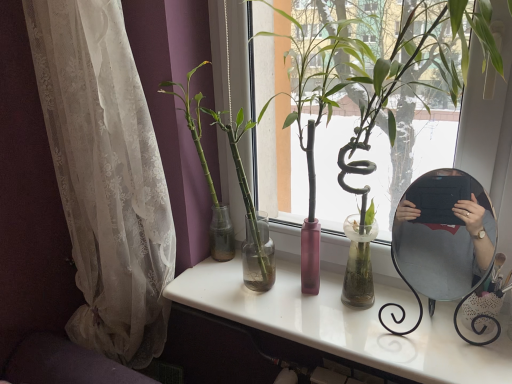
Question: Is white lace curtain at left not near metallic silver mirror at right?

Choices:
 (A) no
 (B) yes

Answer: (A)

Question: From the image's perspective, is white lace curtain at left under metallic silver mirror at right?

Choices:
 (A) yes
 (B) no

Answer: (B)

Question: From a real-world perspective, is white lace curtain at left positioned over metallic silver mirror at right based on gravity?

Choices:
 (A) no
 (B) yes

Answer: (B)

Question: Is white lace curtain at left to the right of metallic silver mirror at right from the viewer's perspective?

Choices:
 (A) yes
 (B) no

Answer: (B)

Question: Is white lace curtain at left at the left side of metallic silver mirror at right?

Choices:
 (A) yes
 (B) no

Answer: (A)

Question: Considering the relative sizes of white lace curtain at left and metallic silver mirror at right in the image provided, is white lace curtain at left taller than metallic silver mirror at right?

Choices:
 (A) yes
 (B) no

Answer: (A)

Question: Does white lace curtain at left lie behind green glossy bamboo at center, which is the second houseplant from left to right?

Choices:
 (A) yes
 (B) no

Answer: (A)

Question: Considering the relative positions of white lace curtain at left and green glossy bamboo at center, which is the second houseplant from left to right, in the image provided, is white lace curtain at left to the right of green glossy bamboo at center, which is the second houseplant from left to right, from the viewer's perspective?

Choices:
 (A) yes
 (B) no

Answer: (B)

Question: Can you confirm if white lace curtain at left is taller than green glossy bamboo at center, which is the second houseplant from left to right?

Choices:
 (A) no
 (B) yes

Answer: (B)

Question: Does white lace curtain at left have a lesser height compared to green glossy bamboo at center, arranged as the 1th houseplant when viewed from the right?

Choices:
 (A) no
 (B) yes

Answer: (A)

Question: Considering the relative sizes of white lace curtain at left and green glossy bamboo at center, which is the second houseplant from left to right, in the image provided, is white lace curtain at left thinner than green glossy bamboo at center, which is the second houseplant from left to right,?

Choices:
 (A) no
 (B) yes

Answer: (B)

Question: Considering the relative sizes of white lace curtain at left and green glossy bamboo at center, which is the second houseplant from left to right, in the image provided, is white lace curtain at left wider than green glossy bamboo at center, which is the second houseplant from left to right,?

Choices:
 (A) no
 (B) yes

Answer: (A)

Question: Does white lace curtain at left appear on the left side of white glossy desk at center?

Choices:
 (A) yes
 (B) no

Answer: (A)